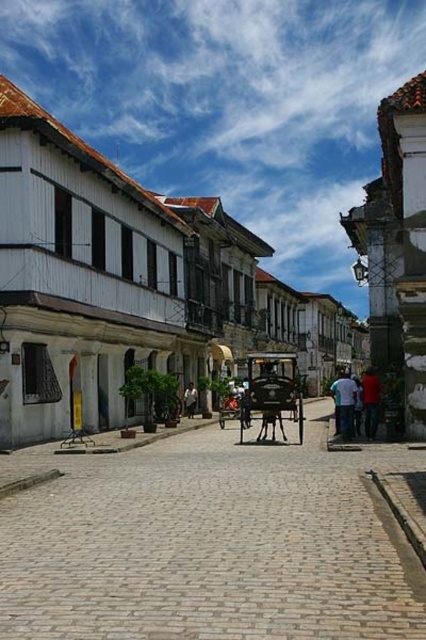
You are a tourist standing on the cobblestone street and see a person wearing a red shirt at center and dark blue jeans at center. Which part of their clothing is closer to you?

The red shirt at center is closer to the viewer than the dark blue jeans at center.